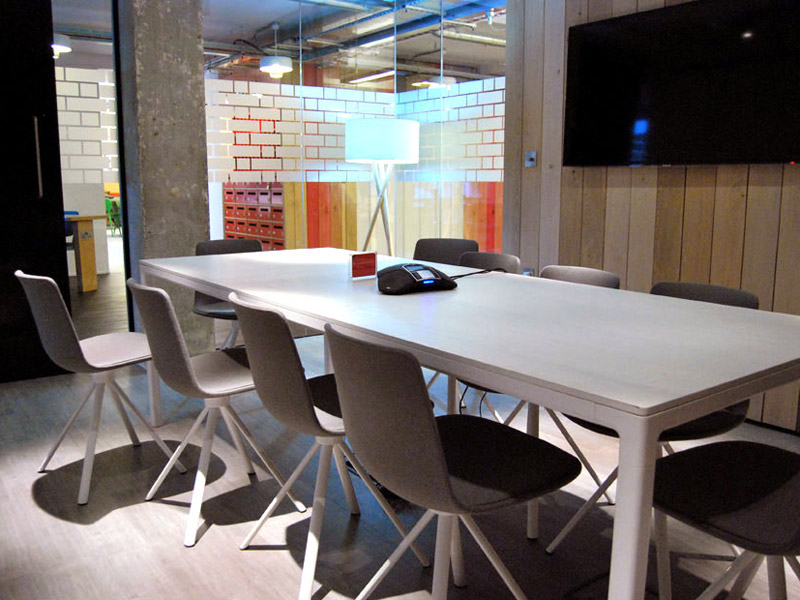
This screenshot has width=800, height=600. Find the location of `white table`. white table is located at coordinates (557, 349).